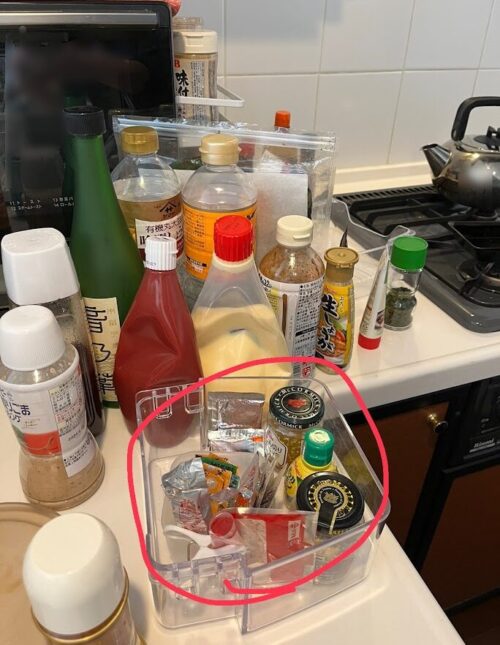
Image resolution: width=500 pixels, height=645 pixels. I want to click on kettle, so click(480, 175).